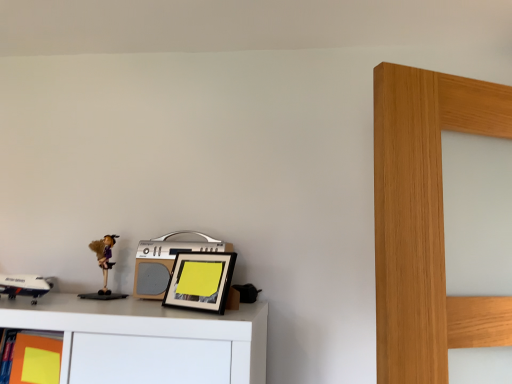
Measure the distance between silver metallic stereo at center and camera.

silver metallic stereo at center and camera are 1.07 meters apart.

At what (x,y) coordinates should I click in order to perform the action: click on matte purple doll at left. Please return your answer as a coordinate pair (x, y). This screenshot has width=512, height=384. Looking at the image, I should click on (104, 258).

From the picture: Would you say black matte picture frame at center is a long distance from silver metallic stereo at center?

No, black matte picture frame at center is not far from silver metallic stereo at center.

Consider the image. From the image's perspective, is black matte picture frame at center below silver metallic stereo at center?

Yes, from the image's perspective, black matte picture frame at center is beneath silver metallic stereo at center.

From a real-world perspective, which object stands above the other?

silver metallic stereo at center is physically above.

Does black matte picture frame at center come behind silver metallic stereo at center?

No, black matte picture frame at center is closer to the camera.

Consider the image. Who is more distant, silver metallic stereo at center or matte yellow sticky note at lower left?

silver metallic stereo at center is further from the camera.

Looking at this image, from a real-world perspective, is silver metallic stereo at center beneath matte yellow sticky note at lower left?

Incorrect, from a real-world perspective, silver metallic stereo at center is higher than matte yellow sticky note at lower left.

Is silver metallic stereo at center taller than matte yellow sticky note at lower left?

No, silver metallic stereo at center is not taller than matte yellow sticky note at lower left.

Which is more to the left, silver metallic stereo at center or matte yellow sticky note at lower left?

From the viewer's perspective, matte yellow sticky note at lower left appears more on the left side.

Is black matte picture frame at center to the right of matte purple doll at left from the viewer's perspective?

Yes, black matte picture frame at center is to the right of matte purple doll at left.

Considering the relative sizes of black matte picture frame at center and matte purple doll at left in the image provided, is black matte picture frame at center bigger than matte purple doll at left?

Yes, black matte picture frame at center is bigger than matte purple doll at left.

Which of these two, black matte picture frame at center or matte purple doll at left, stands taller?

With more height is black matte picture frame at center.

Where is `picture frame below the matte purple doll at left (from the image's perspective)`? This screenshot has width=512, height=384. picture frame below the matte purple doll at left (from the image's perspective) is located at coordinates (200, 281).

Is the depth of silver metallic stereo at center greater than that of matte purple doll at left?

No, silver metallic stereo at center is closer to the viewer.

Considering the relative sizes of silver metallic stereo at center and matte purple doll at left in the image provided, is silver metallic stereo at center bigger than matte purple doll at left?

Yes, silver metallic stereo at center is bigger than matte purple doll at left.

Considering the sizes of objects silver metallic stereo at center and matte purple doll at left in the image provided, who is wider, silver metallic stereo at center or matte purple doll at left?

silver metallic stereo at center is wider.

Between silver metallic stereo at center and matte purple doll at left, which one has more height?

Standing taller between the two is silver metallic stereo at center.

Which is in front, point (163, 284) or point (227, 296)?

The point (227, 296) is more forward.

Would you say silver metallic stereo at center is inside or outside black matte picture frame at center?

silver metallic stereo at center is located beyond the bounds of black matte picture frame at center.

Image resolution: width=512 pixels, height=384 pixels. What are the coordinates of `picture frame in front of the silver metallic stereo at center` in the screenshot? It's located at click(200, 281).

Is matte yellow sticky note at lower left facing away from matte purple doll at left?

No, matte yellow sticky note at lower left's orientation is not away from matte purple doll at left.

Looking at this image, from their relative heights in the image, would you say matte yellow sticky note at lower left is taller or shorter than matte purple doll at left?

Clearly, matte yellow sticky note at lower left is taller compared to matte purple doll at left.

Which object is closer to the camera, matte yellow sticky note at lower left or matte purple doll at left?

matte yellow sticky note at lower left is closer to the camera.

Is matte yellow sticky note at lower left far from matte purple doll at left?

Actually, matte yellow sticky note at lower left and matte purple doll at left are a little close together.

Does black matte picture frame at center have a lesser width compared to matte yellow sticky note at lower left?

No.

Considering the relative sizes of black matte picture frame at center and matte yellow sticky note at lower left in the image provided, is black matte picture frame at center shorter than matte yellow sticky note at lower left?

Correct, black matte picture frame at center is not as tall as matte yellow sticky note at lower left.

Is black matte picture frame at center in front of or behind matte yellow sticky note at lower left in the image?

Clearly, black matte picture frame at center is behind matte yellow sticky note at lower left.

Locate an element on the screen. The width and height of the screenshot is (512, 384). picture frame on the right of silver metallic stereo at center is located at coordinates pyautogui.click(x=200, y=281).

Locate an element on the screen. The image size is (512, 384). stereo lying behind the matte yellow sticky note at lower left is located at coordinates (166, 261).

Estimate the real-world distances between objects in this image. Which object is further from matte yellow sticky note at lower left, matte purple doll at left or silver metallic stereo at center?

silver metallic stereo at center lies further to matte yellow sticky note at lower left than the other object.

From the image, which object appears to be farther from black matte picture frame at center, silver metallic stereo at center or matte purple doll at left?

matte purple doll at left lies further to black matte picture frame at center than the other object.

From the image, which object appears to be nearer to silver metallic stereo at center, matte purple doll at left or matte yellow sticky note at lower left?

matte purple doll at left is closer to silver metallic stereo at center.

Estimate the real-world distances between objects in this image. Which object is further from silver metallic stereo at center, matte yellow sticky note at lower left or matte purple doll at left?

matte yellow sticky note at lower left lies further to silver metallic stereo at center than the other object.

Estimate the real-world distances between objects in this image. Which object is further from matte yellow sticky note at lower left, black matte picture frame at center or silver metallic stereo at center?

black matte picture frame at center is further to matte yellow sticky note at lower left.

Estimate the real-world distances between objects in this image. Which object is closer to matte yellow sticky note at lower left, silver metallic stereo at center or matte purple doll at left?

The object closer to matte yellow sticky note at lower left is matte purple doll at left.

Considering their positions, is matte purple doll at left positioned further to black matte picture frame at center than silver metallic stereo at center?

Based on the image, matte purple doll at left appears to be further to black matte picture frame at center.

In the scene shown: Which object lies nearer to the anchor point black matte picture frame at center, matte yellow sticky note at lower left or matte purple doll at left?

matte purple doll at left.

The width and height of the screenshot is (512, 384). I want to click on stereo situated between matte purple doll at left and black matte picture frame at center from left to right, so click(x=166, y=261).

This screenshot has width=512, height=384. What are the coordinates of `stereo between matte purple doll at left and matte yellow sticky note at lower left from top to bottom` in the screenshot? It's located at (166, 261).

I want to click on stereo situated between matte yellow sticky note at lower left and black matte picture frame at center from left to right, so point(166,261).

I want to click on toy situated between matte yellow sticky note at lower left and black matte picture frame at center from left to right, so click(104, 258).